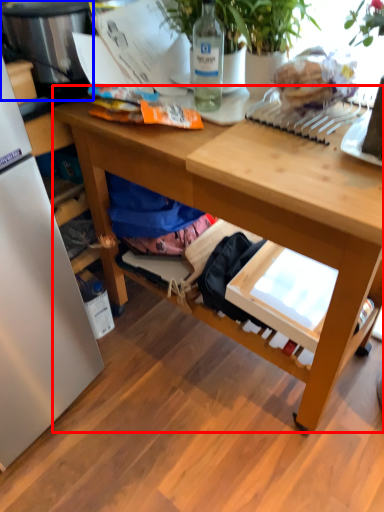
Question: Which point is closer to the camera, desk (highlighted by a red box) or appliance (highlighted by a blue box)?

Choices:
 (A) desk
 (B) appliance

Answer: (A)